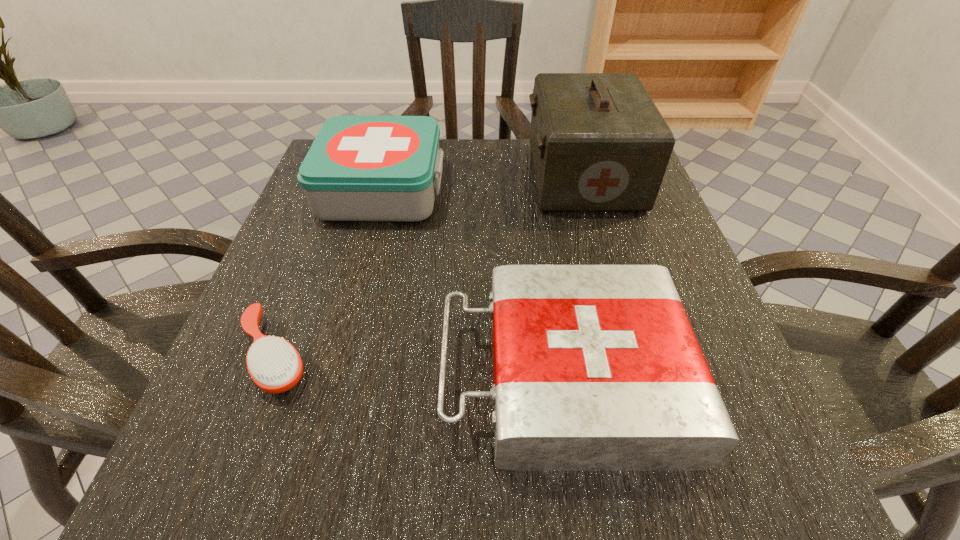
This screenshot has width=960, height=540. What are the coordinates of `free spot between the leftmost first-aid kit and the shortest object` in the screenshot? It's located at (329, 272).

Locate an element on the screen. This screenshot has height=540, width=960. the second closest object to the nearest first-aid kit is located at coordinates pos(359,168).

You are a GUI agent. You are given a task and a screenshot of the screen. Output one action in this format:
    pyautogui.click(x=<x>, y=<y>)
    Task: Click on the object that is the third closest one to the leftmost first-aid kit
    The height and width of the screenshot is (540, 960).
    Given the screenshot: What is the action you would take?
    pyautogui.click(x=275, y=366)

Locate which first-aid kit ranks in proximity to the nearest first-aid kit. Please provide its 2D coordinates. Your answer should be formatted as a tuple, i.e. [(x, y)], where the tuple contains the x and y coordinates of a point satisfying the conditions above.

[(359, 168)]

Locate which first-aid kit is the second closest to the shortest first-aid kit. Please provide its 2D coordinates. Your answer should be formatted as a tuple, i.e. [(x, y)], where the tuple contains the x and y coordinates of a point satisfying the conditions above.

[(599, 143)]

Locate an element on the screen. The width and height of the screenshot is (960, 540). vacant space that satisfies the following two spatial constraints: 1. on the back side of the leftmost first-aid kit; 2. on the right side of the shortest object is located at coordinates (339, 189).